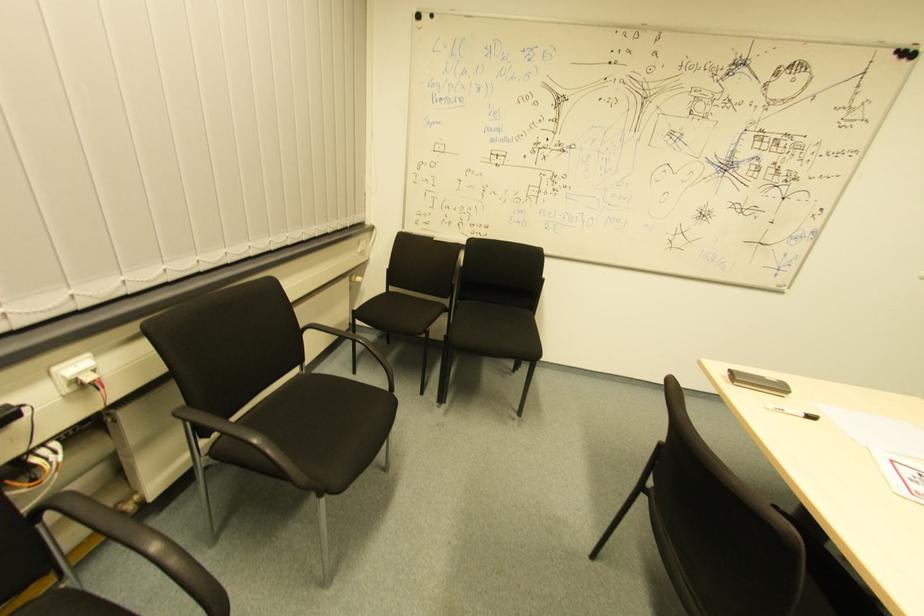
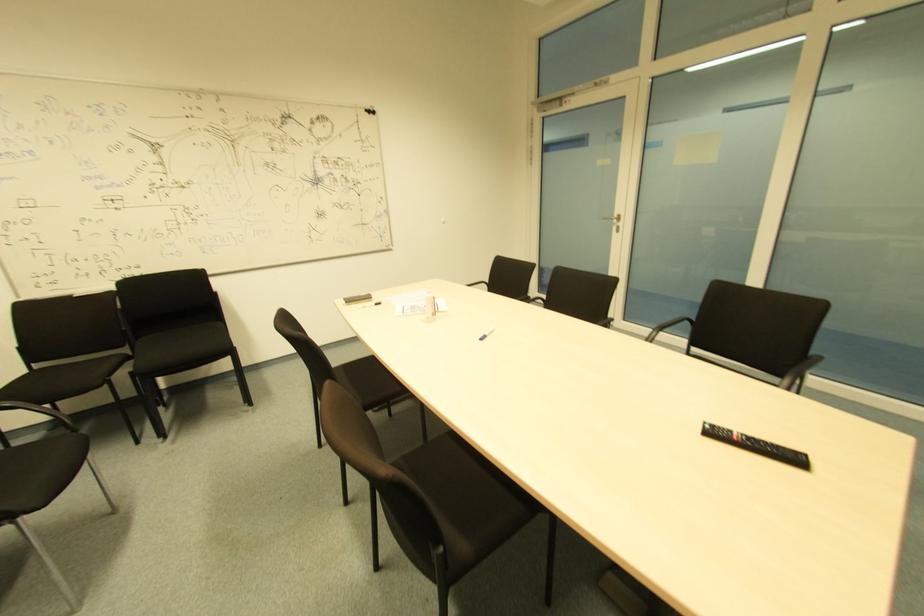
Locate, in the second image, the point that corresponds to (775,392) in the first image.

(365, 301)